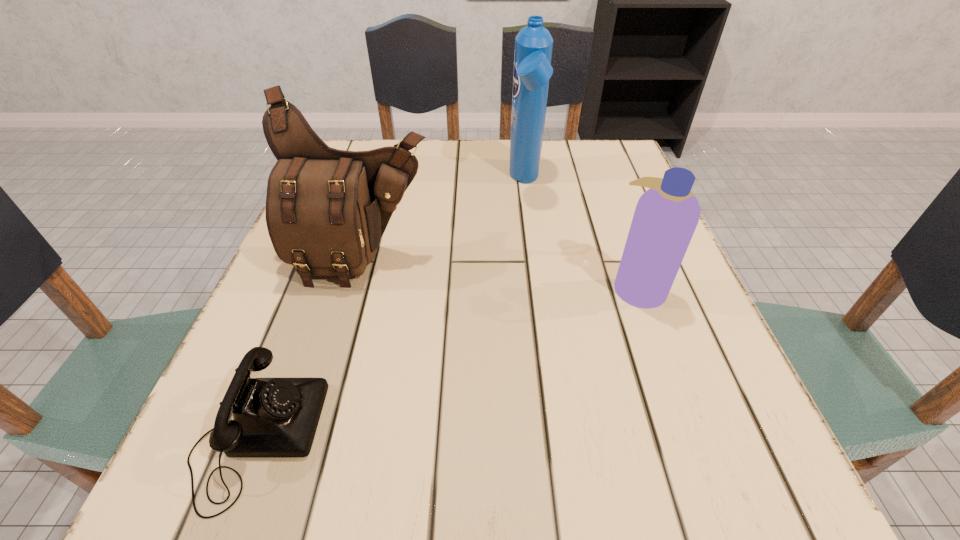
Locate an element on the screen. Image resolution: width=960 pixels, height=540 pixels. free spot that satisfies the following two spatial constraints: 1. on the front-facing side of the rightmost object; 2. on the right side of the shoulder bag is located at coordinates (355, 288).